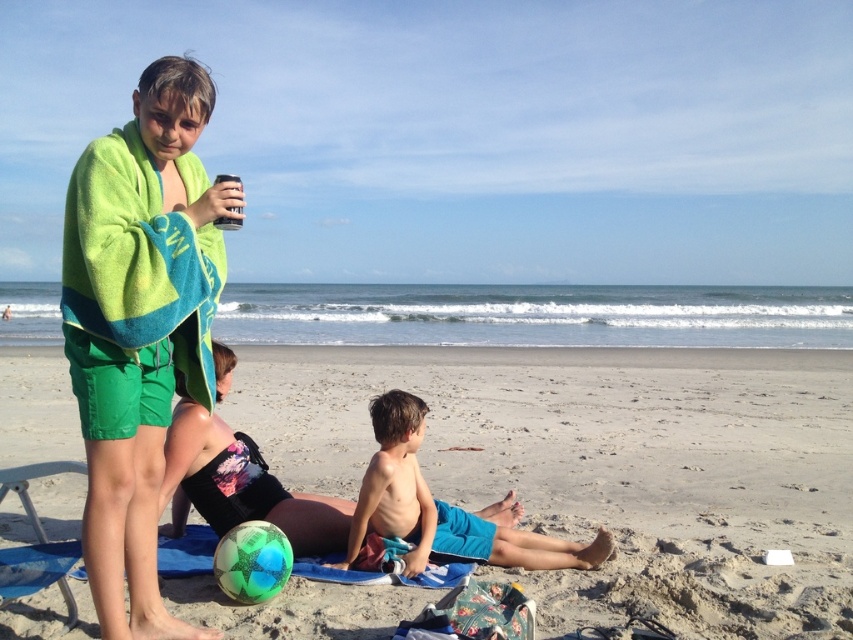
You are a photographer taking a photo of the smooth skin boy at center and the black plastic can at upper center. Which object appears wider in the photo?

The black plastic can at upper center appears wider than the smooth skin boy at center because it has a greater width according to the description.

You are a photographer trying to capture a photo of the smooth skin boy at center and the black plastic can at upper center. If you want to ensure both subjects are in focus, which one should you focus on first considering their sizes?

The smooth skin boy at center has a smaller size compared to the black plastic can at upper center, so you should focus on the black plastic can at upper center first since it is larger and more prominent in the frame.

You are a photographer positioned at the center of the beach scene. You want to capture a closeup shot of the black fabric bikini bottom at lower left. Based on its coordinates, will it appear in the left half of your camera frame?

The black fabric bikini bottom at lower left is located at point 0.783 on the x and 0.413 on the y axis. Since 0.783 is greater than 0.5, it is positioned in the right half of the frame, so it won not appear in the left half of your camera frame.